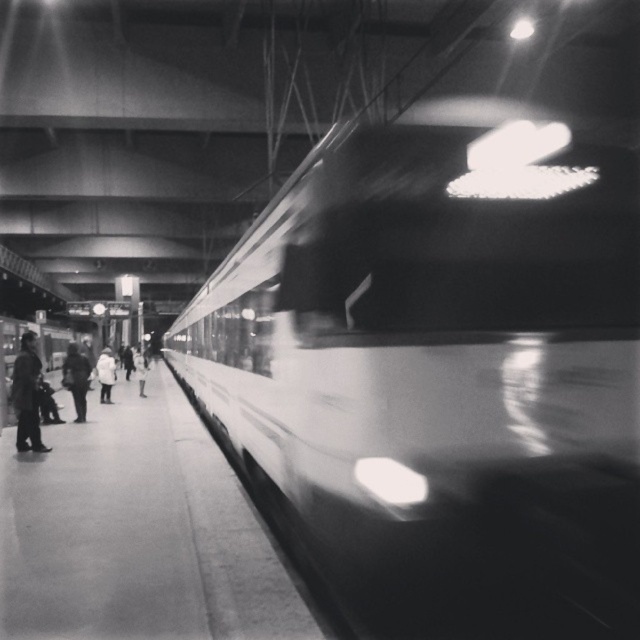
You are standing on the train station platform and want to reach the point marked at coordinates point (504, 384). If you can walk at a speed of 1.2 meters per second, how many seconds will it take you to reach that point?

The distance between you and point (504, 384) is 3.84 meters. At a walking speed of 1.2 meters per second, it will take 3.84 divided by 1.2, which equals 3.2 seconds to reach the point.

You are a photographer standing on the platform and want to capture a clear photo of the dark wool coat at left without the smooth white train at right appearing too large in the frame. Which object should you move closer to, and why?

You should move closer to the dark wool coat at left. Since the smooth white train at right is already closer to the viewer than the dark wool coat at left, moving closer to the coat will reduce the size of the train in the frame relative to the coat, making it less dominant in the photo.